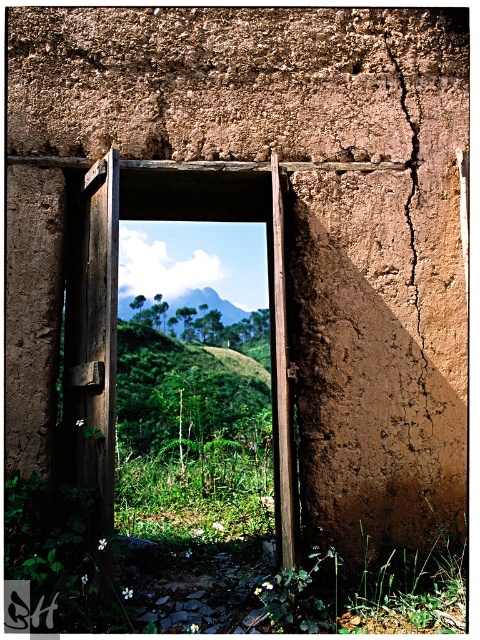
Can you confirm if wooden door at center is bigger than brown cracked wall at right?

Correct, wooden door at center is larger in size than brown cracked wall at right.

The width and height of the screenshot is (480, 640). In order to click on wooden door at center in this screenshot , I will do `click(116, 308)`.

Locate an element on the screen. This screenshot has height=640, width=480. wooden door at center is located at coordinates (116, 308).

Which is below, wooden door at center or green grassy hillside at center?

wooden door at center is lower down.

Consider the image. Who is taller, wooden door at center or green grassy hillside at center?

wooden door at center

Between point (253, 216) and point (182, 301), which one is positioned behind?

Point (182, 301)

I want to click on wooden door at center, so click(116, 308).

Does brown cracked wall at right have a greater height compared to green grassy hillside at center?

Yes, brown cracked wall at right is taller than green grassy hillside at center.

The width and height of the screenshot is (480, 640). Find the location of `brown cracked wall at right`. brown cracked wall at right is located at coordinates (409, 173).